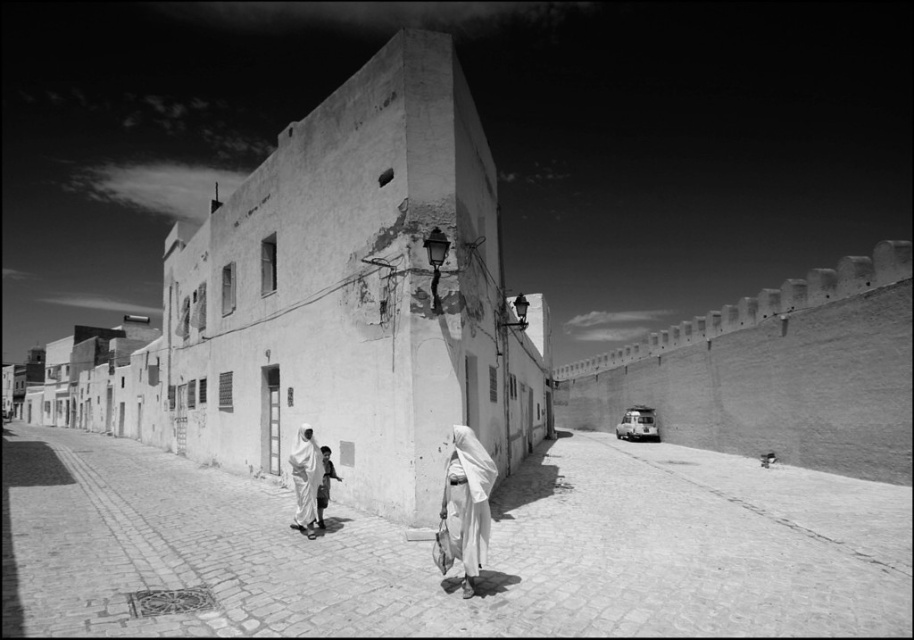
Can you confirm if smooth stone alley at center is shorter than white fabric headscarf at lower center?

Indeed, smooth stone alley at center has a lesser height compared to white fabric headscarf at lower center.

Does smooth stone alley at center appear on the right side of white fabric headscarf at lower center?

Incorrect, smooth stone alley at center is not on the right side of white fabric headscarf at lower center.

The height and width of the screenshot is (640, 914). Find the location of `smooth stone alley at center`. smooth stone alley at center is located at coordinates (430, 547).

The image size is (914, 640). Find the location of `smooth stone alley at center`. smooth stone alley at center is located at coordinates (430, 547).

Who is positioned more to the left, white cloth at center or white fabric headscarf at lower center?

Positioned to the left is white fabric headscarf at lower center.

Does white cloth at center appear under white fabric headscarf at lower center?

Actually, white cloth at center is above white fabric headscarf at lower center.

Where is `white cloth at center`? The width and height of the screenshot is (914, 640). white cloth at center is located at coordinates (466, 502).

Does point (102, 625) come farther from viewer compared to point (484, 474)?

That is False.

Does smooth stone alley at center have a greater width compared to white cloth at center?

Correct, the width of smooth stone alley at center exceeds that of white cloth at center.

The height and width of the screenshot is (640, 914). Identify the location of smooth stone alley at center. (430, 547).

Locate an element on the screen. The image size is (914, 640). smooth stone alley at center is located at coordinates (430, 547).